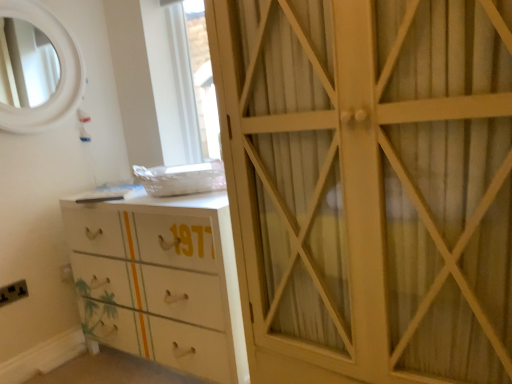
Measure the distance between point (4, 292) and camera.

Point (4, 292) is 1.97 meters from camera.

Measure the distance between point (233, 134) and camera.

Point (233, 134) and camera are 4.55 feet apart from each other.

The image size is (512, 384). In order to click on black plastic electric outlet at lower left in this screenshot , I will do `click(13, 292)`.

How many degrees apart are the facing directions of black plastic electric outlet at lower left and white glossy chest of drawers at lower left?

89.7 degrees.

Between black plastic electric outlet at lower left and white glossy chest of drawers at lower left, which one appears on the right side from the viewer's perspective?

white glossy chest of drawers at lower left.

Looking at this image, is black plastic electric outlet at lower left positioned before white glossy chest of drawers at lower left?

No, the depth of black plastic electric outlet at lower left is greater than that of white glossy chest of drawers at lower left.

From the image's perspective, relative to white glossy chest of drawers at lower left, is black plastic electric outlet at lower left above or below?

From the image's perspective, black plastic electric outlet at lower left appears below white glossy chest of drawers at lower left.

From the picture: How different are the orientations of white glossy chest of drawers at lower left and black plastic electric outlet at lower left in degrees?

They differ by 89.7 degrees in their facing directions.

Is white glossy chest of drawers at lower left positioned with its back to black plastic electric outlet at lower left?

No, white glossy chest of drawers at lower left is not facing the opposite direction of black plastic electric outlet at lower left.

Locate an element on the screen. Image resolution: width=512 pixels, height=384 pixels. the chest of drawers beneath the black plastic electric outlet at lower left (from a real-world perspective) is located at coordinates (161, 280).

From the image's perspective, which one is positioned lower, white glossy chest of drawers at lower left or black plastic electric outlet at lower left?

black plastic electric outlet at lower left appears lower in the image.

Considering the sizes of objects black plastic electric outlet at lower left and white wood cabinet at right in the image provided, who is smaller, black plastic electric outlet at lower left or white wood cabinet at right?

black plastic electric outlet at lower left.

Which of these two, black plastic electric outlet at lower left or white wood cabinet at right, stands shorter?

black plastic electric outlet at lower left is shorter.

Is point (19, 292) in front of point (456, 199)?

No, (19, 292) is further to viewer.

Based on the photo, from the image's perspective, which is above, black plastic electric outlet at lower left or white wood cabinet at right?

white wood cabinet at right appears higher in the image.

Is white wood cabinet at right far away from white glossy chest of drawers at lower left?

white wood cabinet at right is actually quite close to white glossy chest of drawers at lower left.

Which of these two, white wood cabinet at right or white glossy chest of drawers at lower left, is bigger?

white wood cabinet at right.

Who is shorter, white wood cabinet at right or white glossy chest of drawers at lower left?

white glossy chest of drawers at lower left.

Looking at this image, from a real-world perspective, is white wood cabinet at right physically above white glossy chest of drawers at lower left?

Correct, in the physical world, white wood cabinet at right is higher than white glossy chest of drawers at lower left.

Which of these two, white wood cabinet at right or black plastic electric outlet at lower left, is wider?

Wider between the two is white wood cabinet at right.

Is white wood cabinet at right facing away from black plastic electric outlet at lower left?

white wood cabinet at right is not turned away from black plastic electric outlet at lower left.

Which is behind, white wood cabinet at right or black plastic electric outlet at lower left?

black plastic electric outlet at lower left is more distant.

Between white wood cabinet at right and black plastic electric outlet at lower left, which one has more height?

white wood cabinet at right is taller.

Which of these two, white glossy chest of drawers at lower left or white wood cabinet at right, stands shorter?

Standing shorter between the two is white glossy chest of drawers at lower left.

Can you confirm if white glossy chest of drawers at lower left is positioned to the right of white wood cabinet at right?

No, white glossy chest of drawers at lower left is not to the right of white wood cabinet at right.

Is the position of white glossy chest of drawers at lower left more distant than that of white wood cabinet at right?

Yes, white glossy chest of drawers at lower left is behind white wood cabinet at right.

Identify the location of chest of drawers above the black plastic electric outlet at lower left (from the image's perspective). This screenshot has width=512, height=384. (161, 280).

Locate an element on the screen. Image resolution: width=512 pixels, height=384 pixels. electric outlet on the left of the white glossy chest of drawers at lower left is located at coordinates (13, 292).

Estimate the real-world distances between objects in this image. Which object is closer to white wood cabinet at right, black plastic electric outlet at lower left or white glossy chest of drawers at lower left?

white glossy chest of drawers at lower left lies closer to white wood cabinet at right than the other object.

Estimate the real-world distances between objects in this image. Which object is closer to white glossy chest of drawers at lower left, black plastic electric outlet at lower left or white wood cabinet at right?

white wood cabinet at right is closer to white glossy chest of drawers at lower left.

Estimate the real-world distances between objects in this image. Which object is further from white glossy chest of drawers at lower left, white wood cabinet at right or black plastic electric outlet at lower left?

Among the two, black plastic electric outlet at lower left is located further to white glossy chest of drawers at lower left.

Looking at the image, which one is located closer to white wood cabinet at right, white glossy chest of drawers at lower left or black plastic electric outlet at lower left?

Based on the image, white glossy chest of drawers at lower left appears to be nearer to white wood cabinet at right.

Based on their spatial positions, is white wood cabinet at right or white glossy chest of drawers at lower left closer to black plastic electric outlet at lower left?

Among the two, white glossy chest of drawers at lower left is located nearer to black plastic electric outlet at lower left.

Looking at the image, which one is located further to black plastic electric outlet at lower left, white glossy chest of drawers at lower left or white wood cabinet at right?

white wood cabinet at right.

You are a GUI agent. You are given a task and a screenshot of the screen. Output one action in this format:
    pyautogui.click(x=<x>, y=<y>)
    Task: Click on the chest of drawers situated between black plastic electric outlet at lower left and white wood cabinet at right from left to right
    The image size is (512, 384).
    Given the screenshot: What is the action you would take?
    pyautogui.click(x=161, y=280)